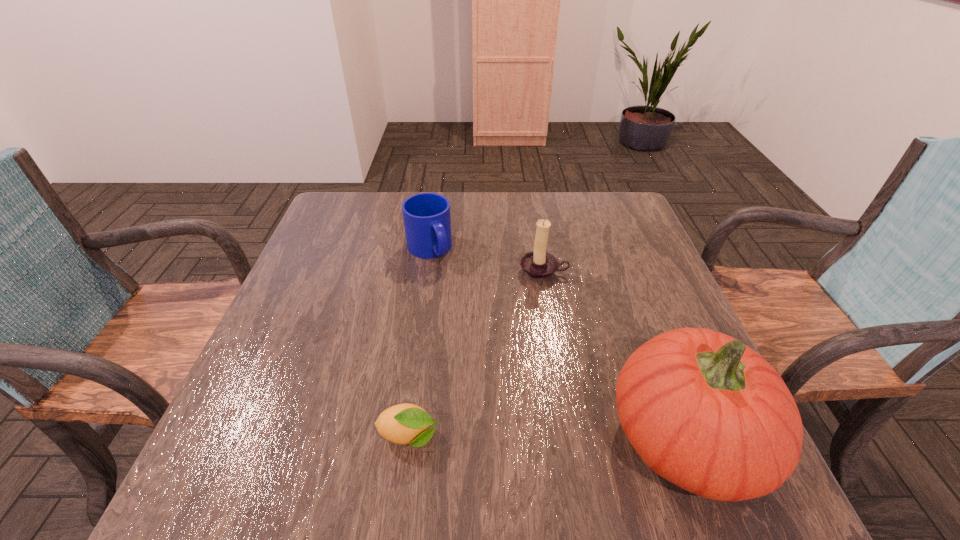
Find the location of a particular element. The image size is (960, 540). free point that satisfies the following two spatial constraints: 1. on the front side of the mug; 2. on the right side of the tallest object is located at coordinates (402, 436).

The width and height of the screenshot is (960, 540). In order to click on free space that satisfies the following two spatial constraints: 1. on the front side of the mug; 2. with leaves positioned above the shortest object in this screenshot , I will do `click(402, 437)`.

You are a GUI agent. You are given a task and a screenshot of the screen. Output one action in this format:
    pyautogui.click(x=<x>, y=<y>)
    Task: Click on the free spot that satisfies the following two spatial constraints: 1. on the front side of the third shortest object; 2. on the left side of the rightmost object
    
    Given the screenshot: What is the action you would take?
    tap(571, 436)

The image size is (960, 540). What are the coordinates of `free location that satisfies the following two spatial constraints: 1. on the front side of the second object from right to left; 2. on the right side of the mug` in the screenshot? It's located at coord(425,272).